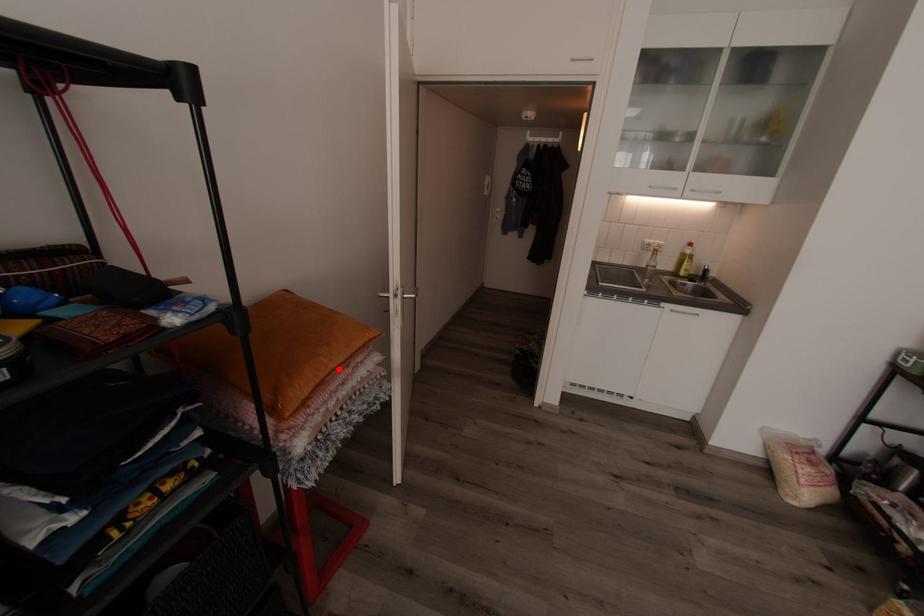
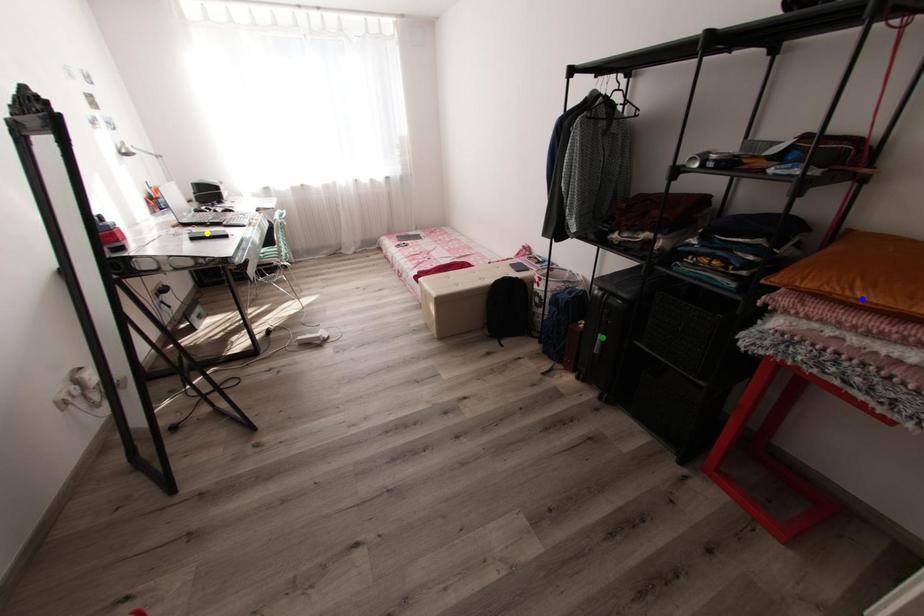
Question: I am providing you with two images of the same scene from different viewpoints. A red point is marked on the first image. You are given multiple points on the second image. Which point in image 2 is actually the same real-world point as the red point in image 1?

Choices:
 (A) blue point
 (B) yellow point
 (C) green point

Answer: (A)